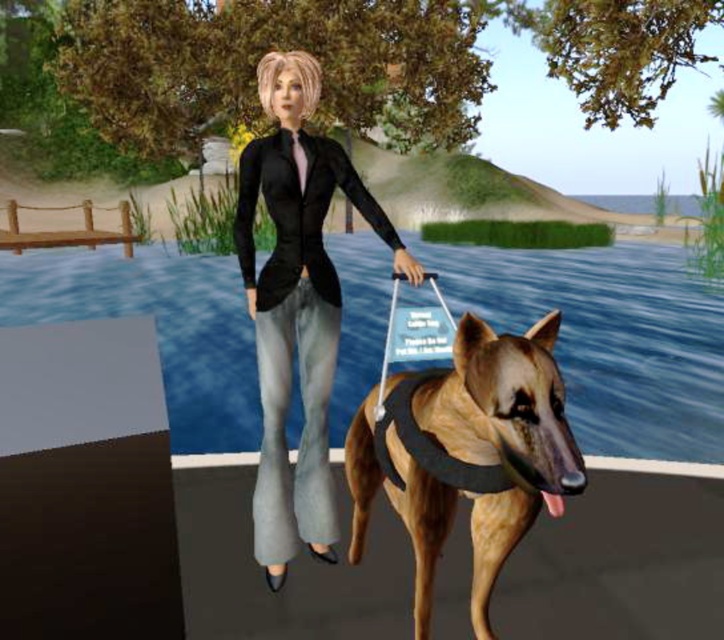
Measure the distance from matte black blazer at center to golden-brown fur harness at center.

The distance of matte black blazer at center from golden-brown fur harness at center is 21.55 inches.

In the scene shown: Which is more to the left, matte black blazer at center or golden-brown fur harness at center?

Positioned to the left is matte black blazer at center.

This screenshot has height=640, width=724. In order to click on matte black blazer at center in this screenshot , I will do `click(295, 304)`.